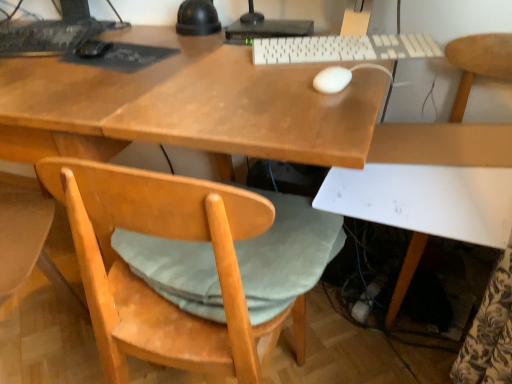
Question: Does white matte chair at lower right have a greater height compared to black matte keyboard at upper left, the first computer keyboard when ordered from left to right?

Choices:
 (A) no
 (B) yes

Answer: (B)

Question: Considering the relative positions of white matte chair at lower right and black matte keyboard at upper left, the first computer keyboard when ordered from left to right, in the image provided, is white matte chair at lower right to the right of black matte keyboard at upper left, the first computer keyboard when ordered from left to right, from the viewer's perspective?

Choices:
 (A) yes
 (B) no

Answer: (A)

Question: Is white matte chair at lower right directly adjacent to black matte keyboard at upper left, placed as the first computer keyboard when sorted from back to front?

Choices:
 (A) yes
 (B) no

Answer: (B)

Question: Is white matte chair at lower right thinner than black matte keyboard at upper left, the first computer keyboard when ordered from left to right?

Choices:
 (A) yes
 (B) no

Answer: (B)

Question: Does white matte chair at lower right appear on the left side of black matte keyboard at upper left, the first computer keyboard when ordered from left to right?

Choices:
 (A) no
 (B) yes

Answer: (A)

Question: In the image, is white matte mouse at center, which ranks as the 2th mouse in left-to-right order, positioned in front of or behind black matte keyboard at upper left, placed as the first computer keyboard when sorted from back to front?

Choices:
 (A) behind
 (B) front

Answer: (B)

Question: Looking at the image, does white matte mouse at center, which is the 2th mouse from back to front, seem bigger or smaller compared to black matte keyboard at upper left, the second computer keyboard positioned from the front?

Choices:
 (A) big
 (B) small

Answer: (B)

Question: From their relative heights in the image, would you say white matte mouse at center, which ranks as the 2th mouse in left-to-right order, is taller or shorter than black matte keyboard at upper left, the second computer keyboard positioned from the front?

Choices:
 (A) short
 (B) tall

Answer: (A)

Question: Based on their positions, is white matte mouse at center, placed as the first mouse when sorted from front to back, located to the left or right of black matte keyboard at upper left, the second computer keyboard positioned from the front?

Choices:
 (A) right
 (B) left

Answer: (A)

Question: Is point (354, 41) closer or farther from the camera than point (129, 274)?

Choices:
 (A) closer
 (B) farther

Answer: (B)

Question: Based on their sizes in the image, would you say white plastic keyboard at center, which is the second computer keyboard in left-to-right order, is bigger or smaller than light wood/rough chair at lower left?

Choices:
 (A) small
 (B) big

Answer: (A)

Question: From a real-world perspective, is white plastic keyboard at center, the 1th computer keyboard when ordered from front to back, positioned above or below light wood/rough chair at lower left?

Choices:
 (A) above
 (B) below

Answer: (A)

Question: From the image's perspective, is white plastic keyboard at center, the 2th computer keyboard in the back-to-front sequence, located above or below light wood/rough chair at lower left?

Choices:
 (A) above
 (B) below

Answer: (A)

Question: Considering the positions of point (377, 132) and point (372, 39), is point (377, 132) closer or farther from the camera than point (372, 39)?

Choices:
 (A) closer
 (B) farther

Answer: (B)

Question: Relative to white plastic keyboard at center, which is the second computer keyboard in left-to-right order, is white matte chair at lower right in front or behind?

Choices:
 (A) front
 (B) behind

Answer: (A)